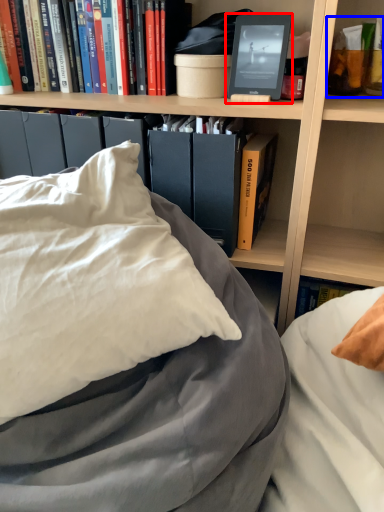
Question: Which of the following is the closest to the observer, paperback book (highlighted by a red box) or book (highlighted by a blue box)?

Choices:
 (A) paperback book
 (B) book

Answer: (A)